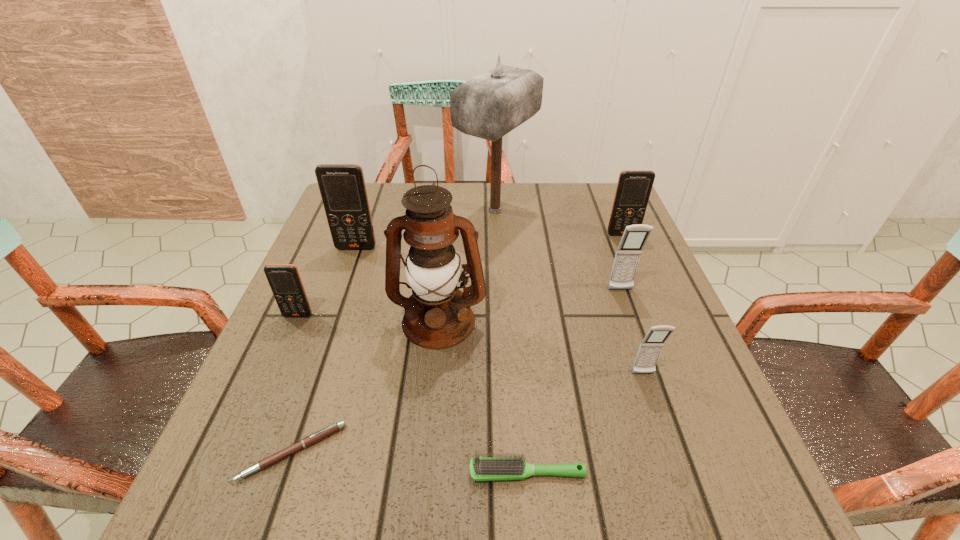
I want to click on free space located on the front-facing side of the fourth farthest object, so click(x=653, y=381).

The image size is (960, 540). In order to click on free space located 0.240m on the screen of the second smallest orange cellular telephone in this screenshot , I will do `click(651, 302)`.

Identify the location of free space located 0.100m on the screen of the smallest orange cellular telephone. (280, 356).

Identify the location of free space located on the front-facing side of the third nearest object. (661, 428).

Where is `vacant space located 0.160m on the right of the hairbrush`? This screenshot has height=540, width=960. vacant space located 0.160m on the right of the hairbrush is located at coordinates (689, 472).

The height and width of the screenshot is (540, 960). Identify the location of object at the far edge. (488, 106).

Identify the location of hairbrush that is at the near edge. (483, 468).

Locate an element on the screen. This screenshot has height=540, width=960. pen positioned at the near edge is located at coordinates (325, 432).

The width and height of the screenshot is (960, 540). I want to click on pen at the left edge, so click(x=325, y=432).

Where is `object positioned at the near left corner`? The image size is (960, 540). object positioned at the near left corner is located at coordinates (325, 432).